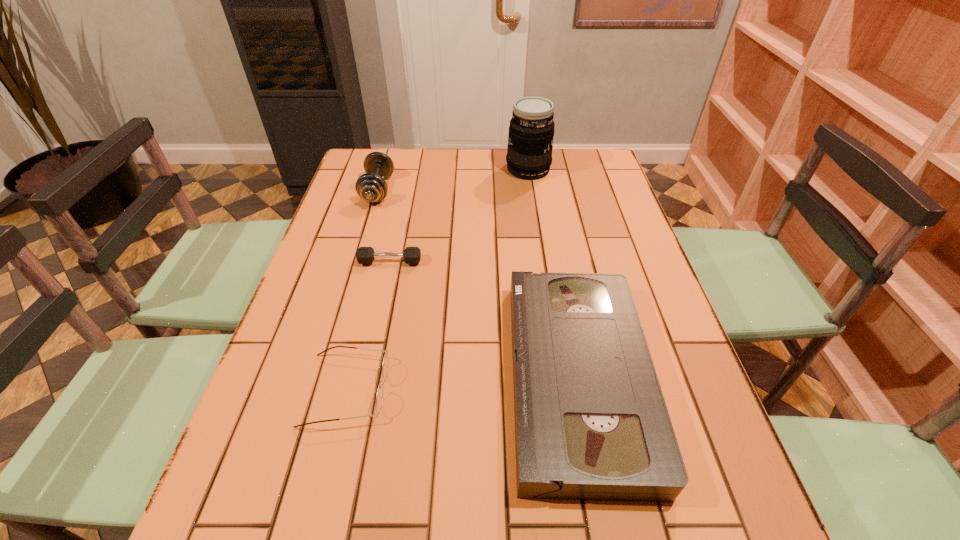
At what (x,y) coordinates should I click in order to perform the action: click on blank area located 0.190m through the lenses of the spectacles. Please return your answer as a coordinate pair (x, y). The width and height of the screenshot is (960, 540). Looking at the image, I should click on (479, 389).

Identify the location of vacant area located 0.060m on the right of the third nearest object. This screenshot has width=960, height=540. (444, 262).

Image resolution: width=960 pixels, height=540 pixels. I want to click on telephoto lens at the far edge, so (x=529, y=154).

Identify the location of dumbbell that is at the far edge. The image size is (960, 540). (371, 187).

Image resolution: width=960 pixels, height=540 pixels. I want to click on spectacles at the left edge, so click(379, 397).

Where is `object at the right edge`? object at the right edge is located at coordinates (591, 423).

You are a GUI agent. You are given a task and a screenshot of the screen. Output one action in this format:
    pyautogui.click(x=<x>, y=<y>)
    Task: Click on the object at the far left corner
    The image size is (960, 540).
    Given the screenshot: What is the action you would take?
    pyautogui.click(x=371, y=187)

Find the location of a particular element. Image resolution: width=960 pixels, height=540 pixels. vacant space at the far edge of the desktop is located at coordinates (466, 149).

The image size is (960, 540). In the image, there is a desktop. In order to click on free space at the left edge in this screenshot , I will do `click(317, 322)`.

In order to click on free space at the right edge in this screenshot , I will do `click(593, 198)`.